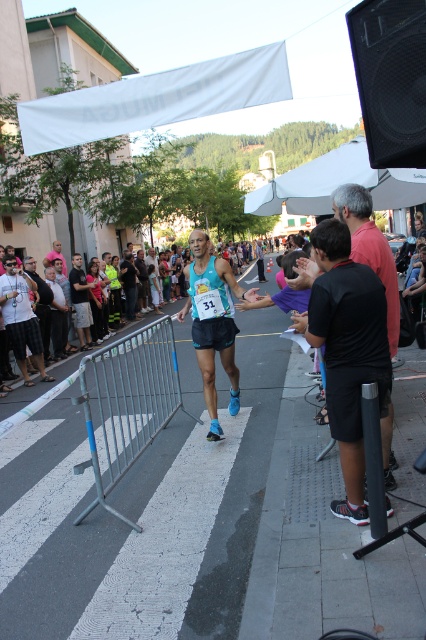
Question: Where is silver metallic rail at center located in relation to matte blue tank top at center in the image?

Choices:
 (A) right
 (B) left

Answer: (A)

Question: Does silver metallic rail at center appear under matte blue tank top at center?

Choices:
 (A) yes
 (B) no

Answer: (A)

Question: Considering the real-world distances, which object is closest to the silver metallic rail at center?

Choices:
 (A) black matte shorts at right
 (B) matte blue tank top at center

Answer: (A)

Question: Among these points, which one is nearest to the camera?

Choices:
 (A) (345, 372)
 (B) (121, 413)
 (C) (97, 323)

Answer: (A)

Question: Among these points, which one is nearest to the camera?

Choices:
 (A) (x=212, y=385)
 (B) (x=92, y=301)
 (C) (x=380, y=369)
 (D) (x=129, y=396)

Answer: (C)

Question: Does silver metallic rail at center appear over matte blue shorts at center?

Choices:
 (A) yes
 (B) no

Answer: (B)